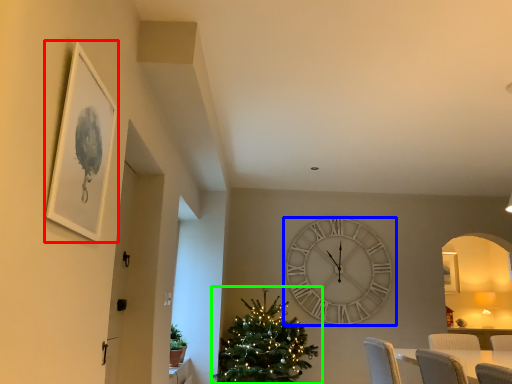
Question: Which is nearer to the picture frame (highlighted by a red box)? wall clock (highlighted by a blue box) or christmas tree (highlighted by a green box).

Choices:
 (A) wall clock
 (B) christmas tree

Answer: (B)